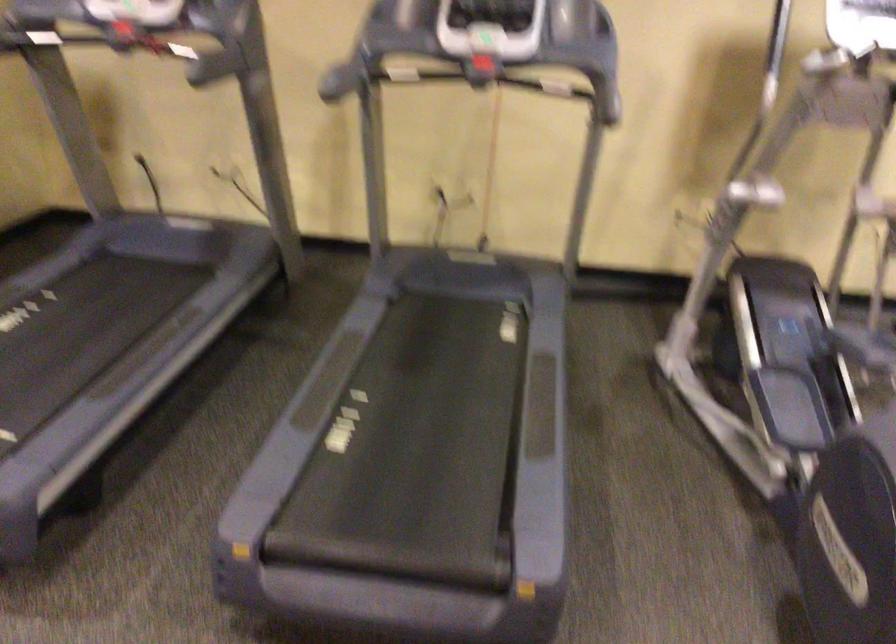
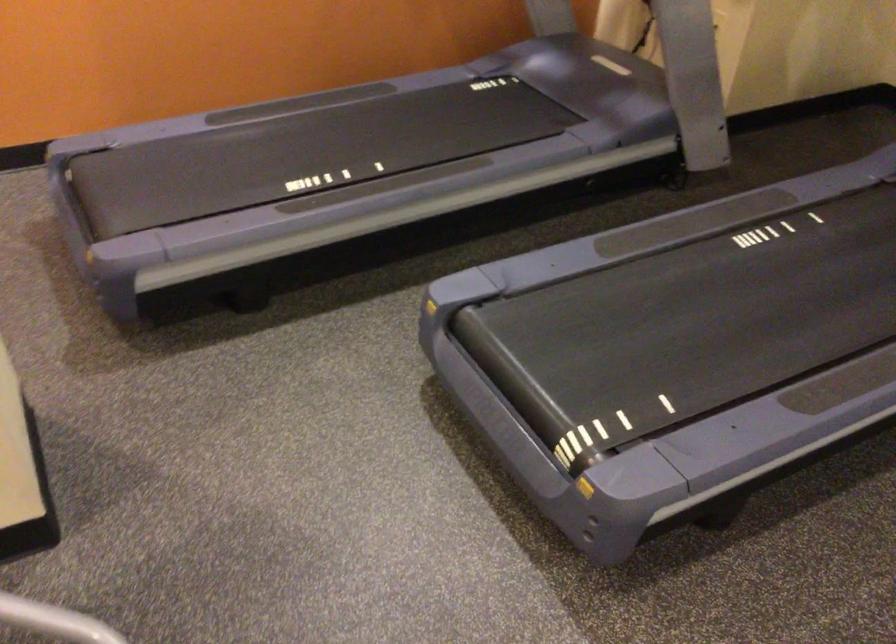
From the picture: The first image is from the beginning of the video and the second image is from the end. How did the camera likely rotate when shooting the video?

The rotation direction of the camera is left-down.